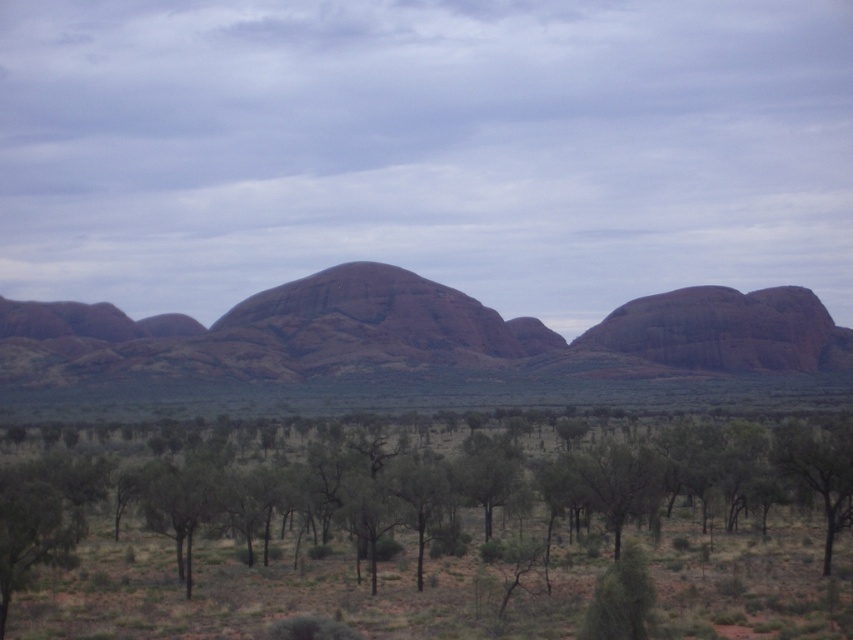
Question: Which object is farther from the camera taking this photo?

Choices:
 (A) rustic rock formation at center
 (B) green leafy tree at lower right

Answer: (A)

Question: Can you confirm if rustic rock formation at center is smaller than green leafy tree at lower right?

Choices:
 (A) yes
 (B) no

Answer: (B)

Question: Which of the following is the farthest from the observer?

Choices:
 (A) (827, 572)
 (B) (521, 346)

Answer: (B)

Question: Does rustic rock formation at center appear over green leafy tree at lower right?

Choices:
 (A) yes
 (B) no

Answer: (A)

Question: Observing the image, what is the correct spatial positioning of rustic rock formation at center in reference to green leafy tree at lower right?

Choices:
 (A) left
 (B) right

Answer: (A)